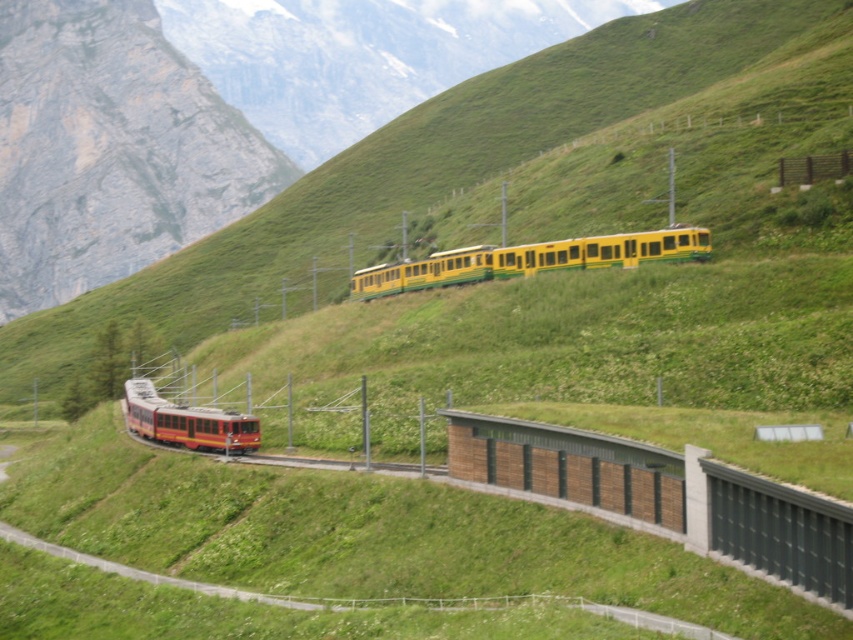
Question: Which of the following is the closest to the observer?

Choices:
 (A) (653, 241)
 (B) (148, 428)

Answer: (A)

Question: Which point appears closest to the camera in this image?

Choices:
 (A) (397, 268)
 (B) (184, 420)

Answer: (B)

Question: Does yellow matte train at center come in front of matte red train at lower left?

Choices:
 (A) yes
 (B) no

Answer: (B)

Question: Can you confirm if yellow matte train at center is positioned above matte red train at lower left?

Choices:
 (A) no
 (B) yes

Answer: (B)

Question: Can you confirm if yellow matte train at center is positioned to the left of matte red train at lower left?

Choices:
 (A) yes
 (B) no

Answer: (B)